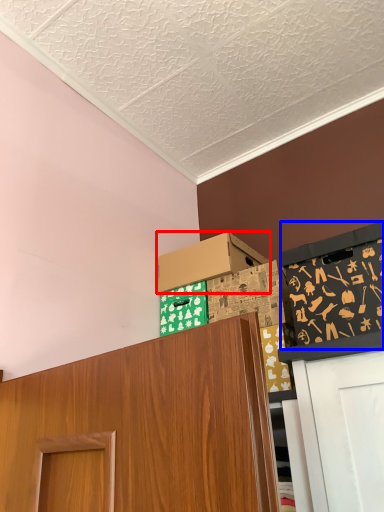
Question: Among these objects, which one is nearest to the camera, box (highlighted by a red box) or bulletin board (highlighted by a blue box)?

Choices:
 (A) box
 (B) bulletin board

Answer: (B)